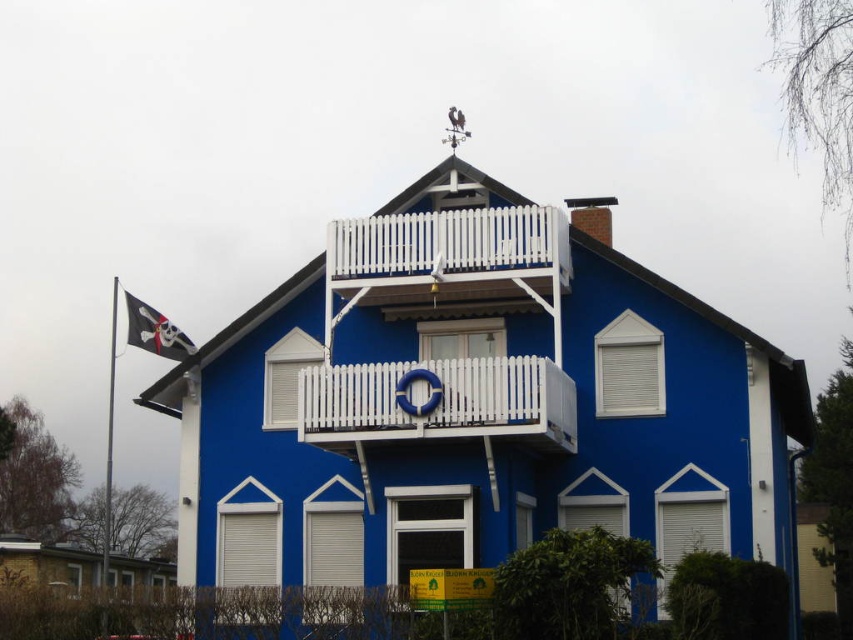
Question: Among these points, which one is farthest from the camera?

Choices:
 (A) (485, 380)
 (B) (132, 298)

Answer: (B)

Question: Does white wooden balustrade at center lie behind black fabric pirate flag at left?

Choices:
 (A) yes
 (B) no

Answer: (B)

Question: Is white wooden balustrade at center to the right of black fabric pirate flag at left from the viewer's perspective?

Choices:
 (A) yes
 (B) no

Answer: (A)

Question: Among these objects, which one is farthest from the camera?

Choices:
 (A) white wooden balustrade at center
 (B) black fabric pirate flag at left

Answer: (B)

Question: Does white wooden balustrade at center have a larger size compared to black fabric pirate flag at left?

Choices:
 (A) yes
 (B) no

Answer: (B)